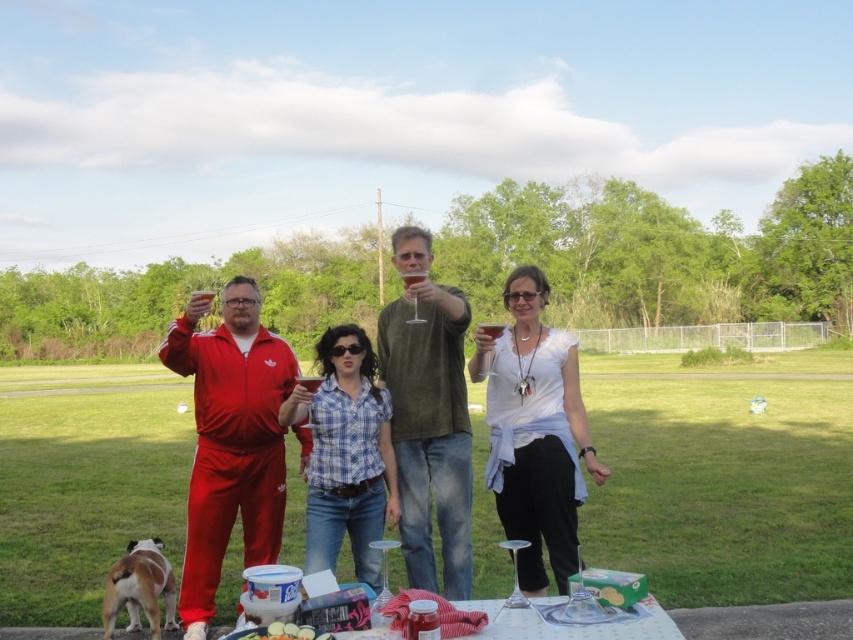
You are a photographer setting up for a group photo. You need to ensure that the matte red tracksuit at center and the white creamy cheese at lower center are both visible in the frame. Given their sizes, which object might require you to adjust your camera angle to ensure it is fully captured?

The matte red tracksuit at center is larger in size than the white creamy cheese at lower center, so you may need to adjust your camera angle to ensure the larger matte red tracksuit at center is fully captured in the frame.

You are a food safety inspector checking the items on the table. You notice the white creamy cheese at lower center and the translucent glass at center. Which item has a greater width?

The white creamy cheese at lower center has a greater width than the translucent glass at center.